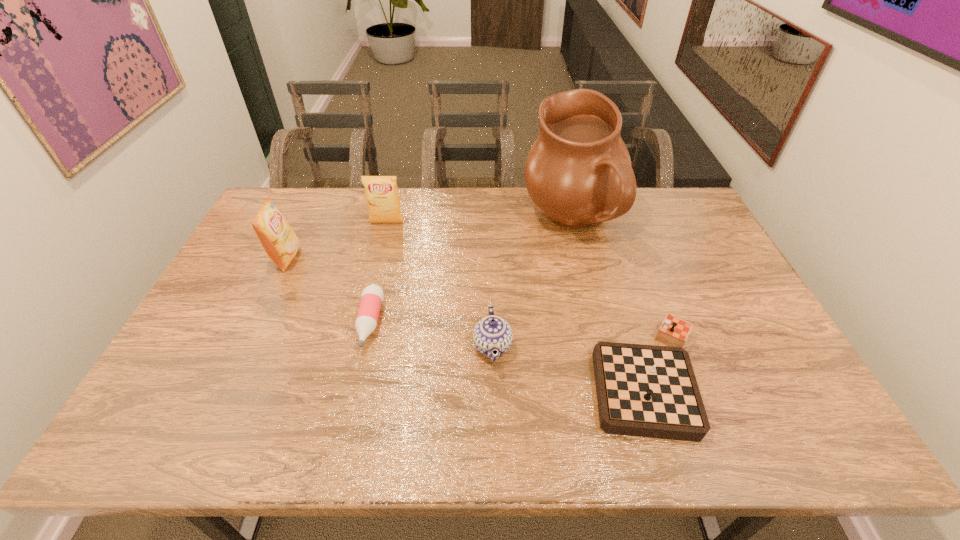
At what (x,y) coordinates should I click in order to perform the action: click on vacant region between the right crisp (potato chip) and the chessboard. Please return your answer as a coordinate pair (x, y). This screenshot has height=540, width=960. Looking at the image, I should click on (517, 300).

Where is `empty space between the second shortest object and the right crisp (potato chip)`? empty space between the second shortest object and the right crisp (potato chip) is located at coordinates (517, 300).

Image resolution: width=960 pixels, height=540 pixels. Identify the location of unoccupied position between the right crisp (potato chip) and the tallest object. (480, 222).

Identify the location of free space between the farther crisp (potato chip) and the cream pitcher. (480, 222).

Find the location of `vacant area between the fourth tallest object and the tallest object`. vacant area between the fourth tallest object and the tallest object is located at coordinates (533, 284).

At what (x,y) coordinates should I click in order to perform the action: click on unoccupied position between the left crisp (potato chip) and the right crisp (potato chip). Please return your answer as a coordinate pair (x, y). This screenshot has width=960, height=540. Looking at the image, I should click on (337, 240).

What are the coordinates of `object that is the fifth closest to the third object from right to left` in the screenshot? It's located at (280, 242).

Locate which object ranks fourth in proximity to the cream pitcher. Please provide its 2D coordinates. Your answer should be formatted as a tuple, i.e. [(x, y)], where the tuple contains the x and y coordinates of a point satisfying the conditions above.

[(372, 296)]

The width and height of the screenshot is (960, 540). Find the location of `blank space that satisfies the following two spatial constraints: 1. at the spout of the cream pitcher; 2. on the front of the right crisp (potato chip) with the logo`. blank space that satisfies the following two spatial constraints: 1. at the spout of the cream pitcher; 2. on the front of the right crisp (potato chip) with the logo is located at coordinates (573, 223).